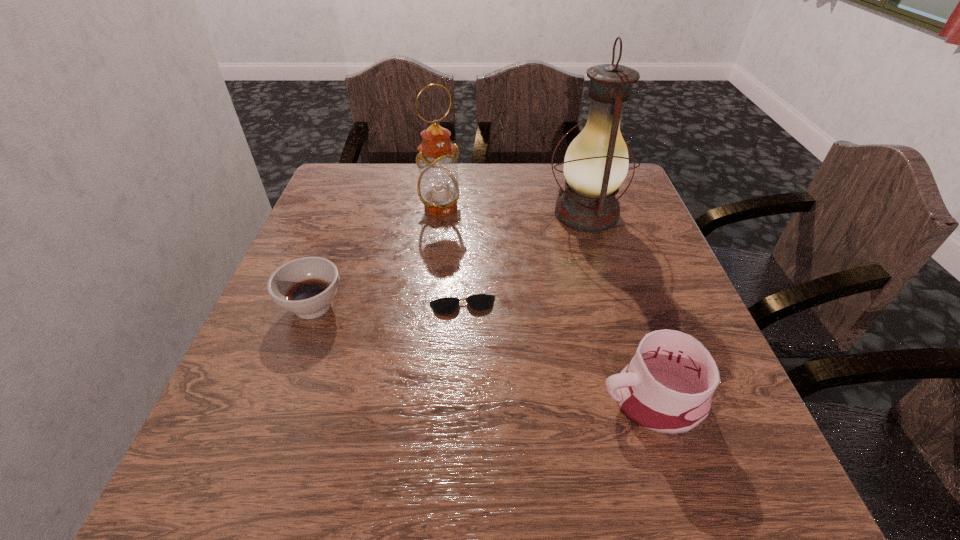
At what (x,y) coordinates should I click in order to perform the action: click on vacant region at the far edge. Please return your answer as a coordinate pair (x, y). Looking at the image, I should click on (481, 188).

Locate an element on the screen. This screenshot has height=540, width=960. vacant space at the near edge of the desktop is located at coordinates (596, 476).

Image resolution: width=960 pixels, height=540 pixels. What are the coordinates of `vacant area at the left edge` in the screenshot? It's located at (338, 293).

Identify the location of free space at the right edge of the desktop. Image resolution: width=960 pixels, height=540 pixels. (636, 266).

This screenshot has height=540, width=960. I want to click on free area in between the soup bowl and the shortest object, so click(x=388, y=306).

Find the location of a particular element. free spot between the shorter oil lamp and the mug is located at coordinates (546, 303).

Find the location of a particular element. This screenshot has height=540, width=960. blank region between the shortest object and the fourth tallest object is located at coordinates (388, 306).

The height and width of the screenshot is (540, 960). What are the coordinates of `free space that is in between the leftmost object and the taller oil lamp` in the screenshot? It's located at (449, 260).

I want to click on vacant area that lies between the shortest object and the right oil lamp, so click(x=524, y=260).

This screenshot has height=540, width=960. Find the location of `free point between the right oil lamp and the shortest object`. free point between the right oil lamp and the shortest object is located at coordinates (524, 260).